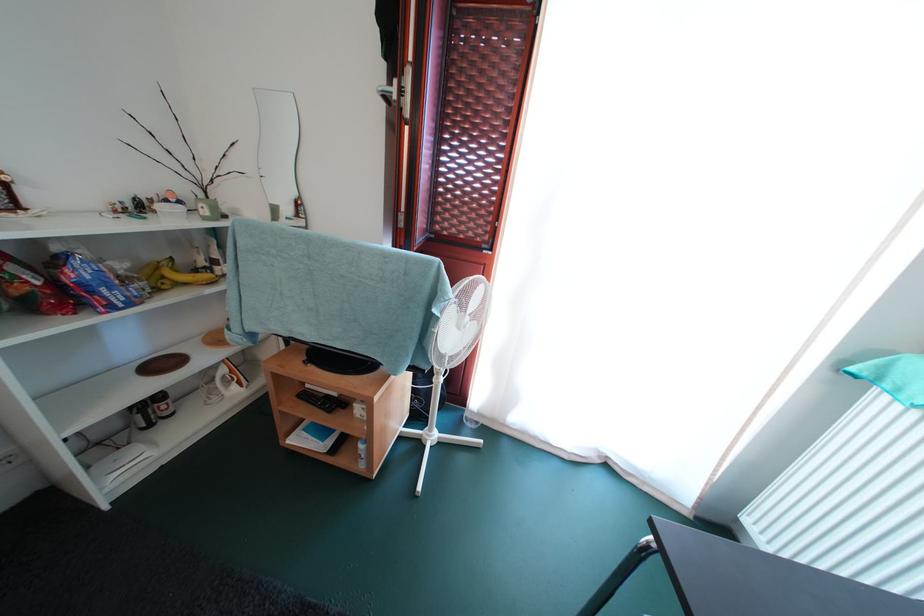
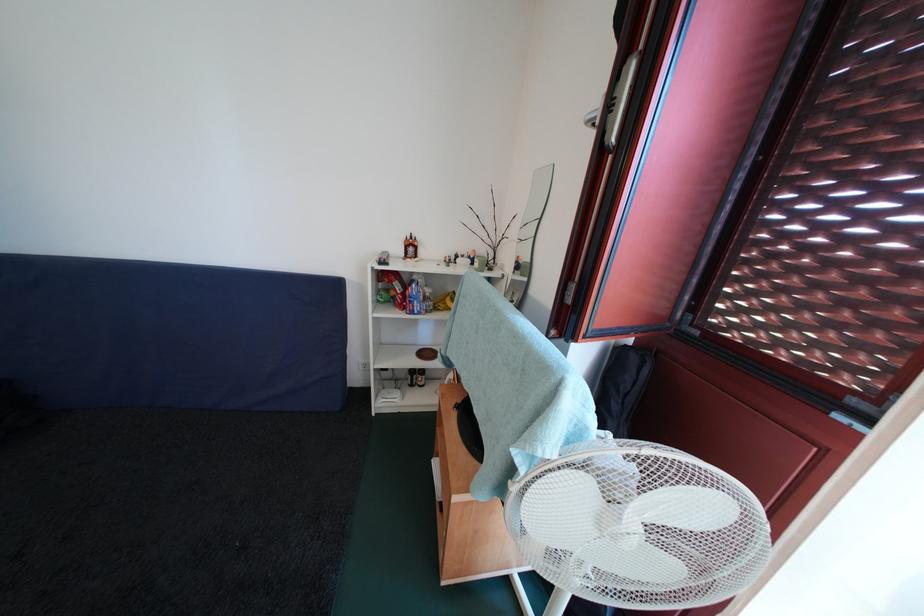
Find the pixel in the second image that matches pixel 408 95 in the first image.

(616, 110)